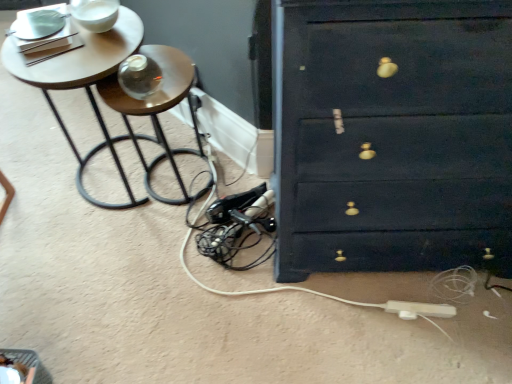
Question: Does wooden round table at upper left have a greater height compared to white plastic extension cord at lower right?

Choices:
 (A) yes
 (B) no

Answer: (A)

Question: From a real-world perspective, does wooden round table at upper left stand above white plastic extension cord at lower right?

Choices:
 (A) yes
 (B) no

Answer: (A)

Question: Is wooden round table at upper left outside of white plastic extension cord at lower right?

Choices:
 (A) yes
 (B) no

Answer: (A)

Question: From the image's perspective, would you say wooden round table at upper left is shown under white plastic extension cord at lower right?

Choices:
 (A) yes
 (B) no

Answer: (B)

Question: Would you consider wooden round table at upper left to be distant from white plastic extension cord at lower right?

Choices:
 (A) yes
 (B) no

Answer: (A)

Question: From the image's perspective, relative to wooden round table at upper left, is white plastic extension cord at lower right above or below?

Choices:
 (A) above
 (B) below

Answer: (B)

Question: Is white plastic extension cord at lower right situated inside wooden round table at upper left or outside?

Choices:
 (A) inside
 (B) outside

Answer: (B)

Question: In the image, is white plastic extension cord at lower right on the left side or the right side of wooden round table at upper left?

Choices:
 (A) left
 (B) right

Answer: (B)

Question: Considering the positions of white plastic extension cord at lower right and wooden round table at upper left in the image, is white plastic extension cord at lower right taller or shorter than wooden round table at upper left?

Choices:
 (A) tall
 (B) short

Answer: (B)

Question: Is wooden side table at left inside the boundaries of wooden round table at upper left, or outside?

Choices:
 (A) inside
 (B) outside

Answer: (A)

Question: Considering the positions of wooden side table at left and wooden round table at upper left in the image, is wooden side table at left taller or shorter than wooden round table at upper left?

Choices:
 (A) short
 (B) tall

Answer: (A)

Question: Looking at their shapes, would you say wooden side table at left is wider or thinner than wooden round table at upper left?

Choices:
 (A) thin
 (B) wide

Answer: (A)

Question: Relative to wooden round table at upper left, is wooden side table at left in front or behind?

Choices:
 (A) behind
 (B) front

Answer: (A)

Question: From the image's perspective, is wooden side table at left above or below white plastic extension cord at lower right?

Choices:
 (A) above
 (B) below

Answer: (A)

Question: From a real-world perspective, is wooden side table at left above or below white plastic extension cord at lower right?

Choices:
 (A) below
 (B) above

Answer: (B)